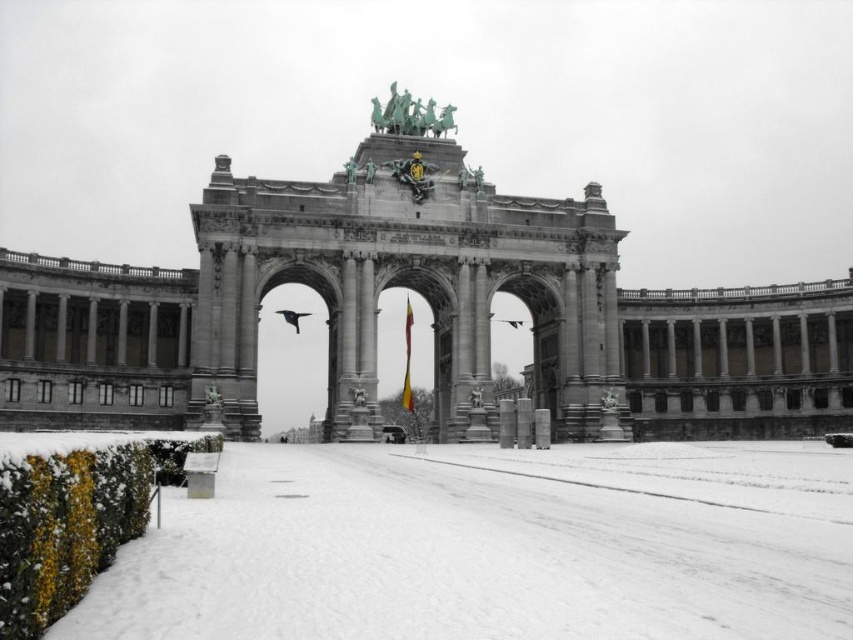
Question: Does stone archway at center have a larger size compared to yellow fabric flag at center?

Choices:
 (A) no
 (B) yes

Answer: (B)

Question: Where is white powdery snow at lower left located in relation to yellow fabric flag at center in the image?

Choices:
 (A) left
 (B) right

Answer: (B)

Question: Which is farther from the stone archway at center?

Choices:
 (A) white powdery snow at lower left
 (B) yellow fabric flag at center

Answer: (B)

Question: Which object is farther from the camera taking this photo?

Choices:
 (A) white powdery snow at lower left
 (B) yellow fabric flag at center

Answer: (B)

Question: Which of these objects is positioned farthest from the stone archway at center?

Choices:
 (A) yellow fabric flag at center
 (B) white powdery snow at lower left

Answer: (A)

Question: Is stone archway at center below white powdery snow at lower left?

Choices:
 (A) yes
 (B) no

Answer: (B)